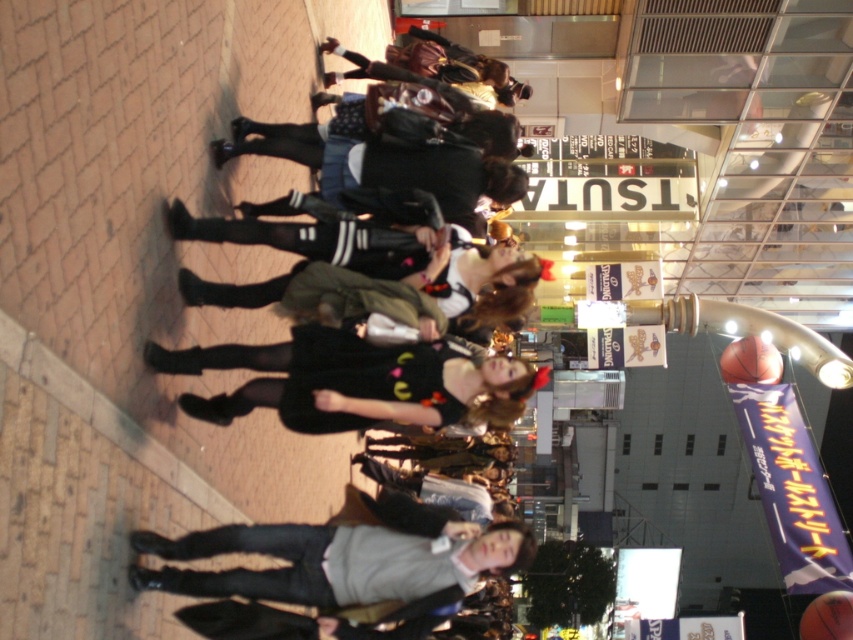
Question: Which object is closer to the camera taking this photo?

Choices:
 (A) rubber textured basketball at right
 (B) black leather jacket at center
 (C) orange textured basketball at center

Answer: (B)

Question: Where is rubber textured basketball at right located in relation to orange textured basketball at center in the image?

Choices:
 (A) left
 (B) right

Answer: (A)

Question: Is black leather jacket at center thinner than orange textured basketball at center?

Choices:
 (A) no
 (B) yes

Answer: (A)

Question: Which object is farther from the camera taking this photo?

Choices:
 (A) rubber textured basketball at right
 (B) black leather jacket at center

Answer: (A)

Question: Does rubber textured basketball at right have a larger size compared to orange textured basketball at center?

Choices:
 (A) yes
 (B) no

Answer: (B)

Question: Among these points, which one is farthest from the camera?

Choices:
 (A) (360, 339)
 (B) (822, 621)
 (C) (767, 372)

Answer: (C)